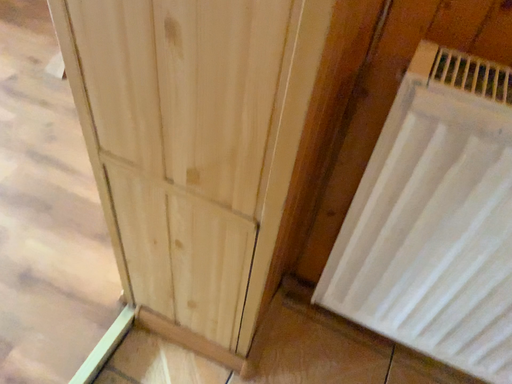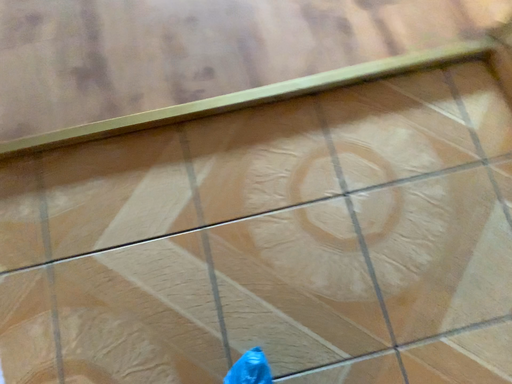
Question: How did the camera likely rotate when shooting the video?

Choices:
 (A) rotated downward
 (B) rotated upward

Answer: (A)